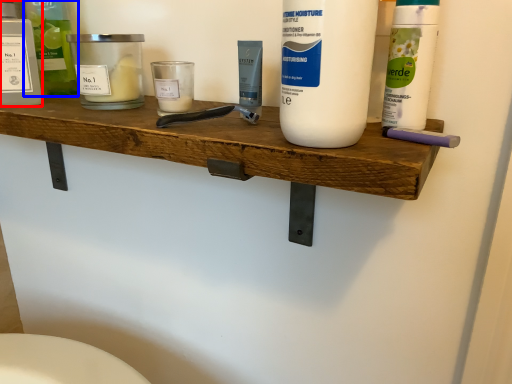
Question: Which point is further to the camera, personal care (highlighted by a red box) or cleaning product (highlighted by a blue box)?

Choices:
 (A) personal care
 (B) cleaning product

Answer: (B)